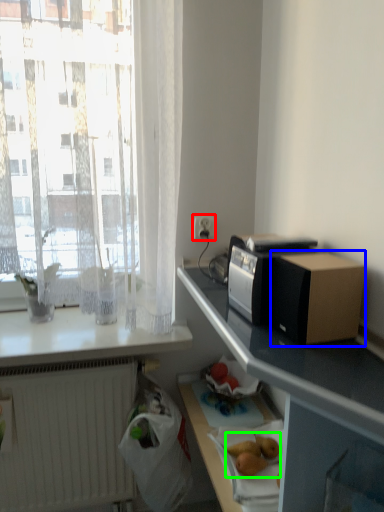
Question: Considering the real-world distances, which object is farthest from electric outlet (highlighted by a red box)? cardboard box (highlighted by a blue box) or fruit (highlighted by a green box)?

Choices:
 (A) cardboard box
 (B) fruit

Answer: (B)